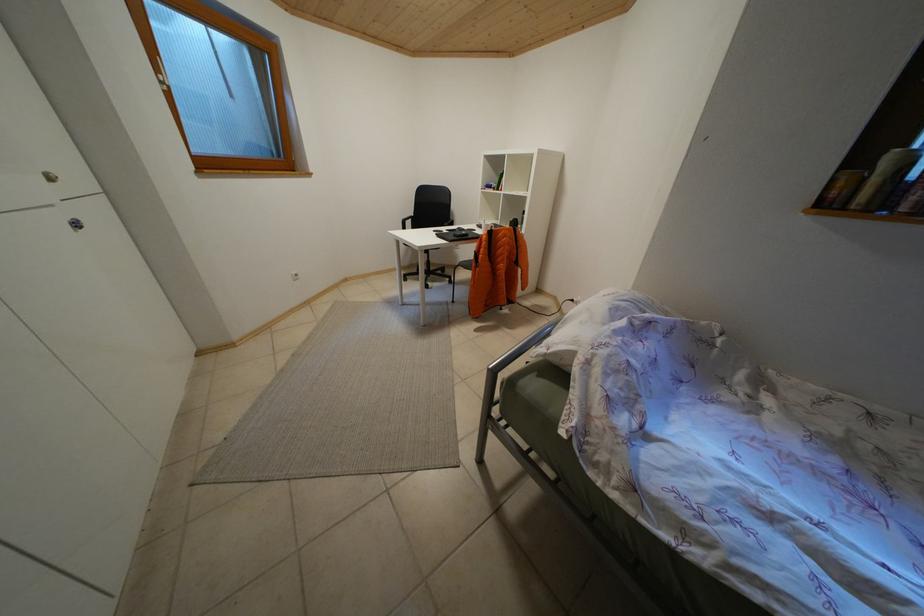
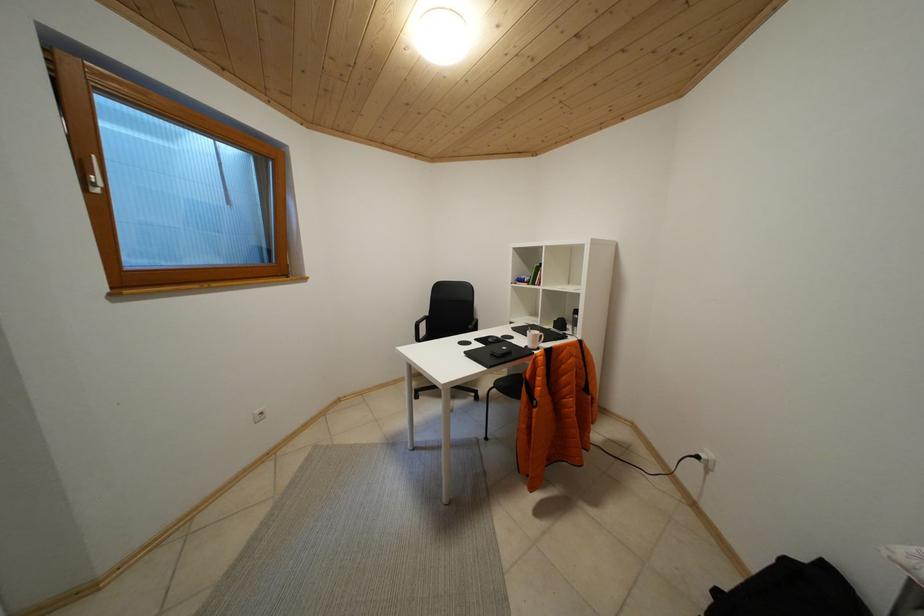
Question: What movement of the cameraman would produce the second image?

Choices:
 (A) Left
 (B) Right
 (C) Forward
 (D) Backward

Answer: (C)